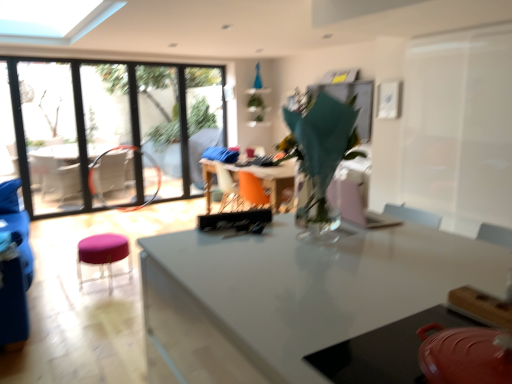
I want to click on translucent glass vase at center, so click(319, 158).

Describe the element at coordinates (271, 179) in the screenshot. I see `transparent glass vase at center, the first table from the top` at that location.

This screenshot has width=512, height=384. What do you see at coordinates (103, 255) in the screenshot?
I see `purple fabric stool at lower left` at bounding box center [103, 255].

The width and height of the screenshot is (512, 384). Describe the element at coordinates (257, 107) in the screenshot. I see `green leafy plant at upper center` at that location.

What do you see at coordinates (109, 130) in the screenshot? This screenshot has width=512, height=384. I see `transparent glass window at left` at bounding box center [109, 130].

What is the approximate width of transparent plastic screen door at right?

It is 4.58 inches.

The width and height of the screenshot is (512, 384). In order to click on translucent glass vase at center in this screenshot , I will do `click(319, 158)`.

Could you tell me if green leafy plant at upper center is facing purple fabric stool at lower left?

No, green leafy plant at upper center is not facing towards purple fabric stool at lower left.

Is green leafy plant at upper center not near purple fabric stool at lower left?

That's right, there is a large distance between green leafy plant at upper center and purple fabric stool at lower left.

Which of these two, green leafy plant at upper center or purple fabric stool at lower left, is smaller?

green leafy plant at upper center.

What's the angular difference between green leafy plant at upper center and purple fabric stool at lower left's facing directions?

green leafy plant at upper center and purple fabric stool at lower left are facing 82.8 degrees away from each other.

In terms of height, does matte red pot at lower right, which ranks as the 1th table in front-to-back order, look taller or shorter compared to transparent plastic screen door at right?

Clearly, matte red pot at lower right, which ranks as the 1th table in front-to-back order, is shorter compared to transparent plastic screen door at right.

Is matte red pot at lower right, which ranks as the first table in bottom-to-top order, next to transparent plastic screen door at right?

matte red pot at lower right, which ranks as the first table in bottom-to-top order, and transparent plastic screen door at right are not in contact.

Based on the photo, measure the distance from matte red pot at lower right, acting as the 2th table starting from the back, to transparent plastic screen door at right.

matte red pot at lower right, acting as the 2th table starting from the back, and transparent plastic screen door at right are 2.25 meters apart.

Is point (381, 361) closer to camera compared to point (467, 93)?

Yes.

Is transparent glass window at left not within matte red pot at lower right, which ranks as the 1th table in front-to-back order?

transparent glass window at left is positioned outside matte red pot at lower right, which ranks as the 1th table in front-to-back order.

Is transparent glass window at left to the left of matte red pot at lower right, which ranks as the first table in bottom-to-top order, from the viewer's perspective?

Correct, you'll find transparent glass window at left to the left of matte red pot at lower right, which ranks as the first table in bottom-to-top order.

From a real-world perspective, between transparent glass window at left and matte red pot at lower right, acting as the 2th table starting from the back, who is vertically lower?

matte red pot at lower right, acting as the 2th table starting from the back, is physically lower.

Where is `window above the matte red pot at lower right, the 2th table when ordered from top to bottom (from the image's perspective)`? The image size is (512, 384). window above the matte red pot at lower right, the 2th table when ordered from top to bottom (from the image's perspective) is located at coordinates (109, 130).

What's the angular difference between transparent plastic screen door at right and translucent glass vase at center's facing directions?

The facing directions of transparent plastic screen door at right and translucent glass vase at center are 89.9 degrees apart.

Looking at this image, would you say transparent plastic screen door at right is outside translucent glass vase at center?

Absolutely, transparent plastic screen door at right is external to translucent glass vase at center.

Is transparent plastic screen door at right beside translucent glass vase at center?

No, transparent plastic screen door at right is not next to translucent glass vase at center.

Based on their positions, is transparent plastic screen door at right located to the left or right of translucent glass vase at center?

transparent plastic screen door at right is to the right of translucent glass vase at center.

Is there a large distance between matte red pot at lower right, the 2th table when ordered from top to bottom, and transparent glass vase at center, the first table from the top?

Yes, matte red pot at lower right, the 2th table when ordered from top to bottom, and transparent glass vase at center, the first table from the top, are quite far apart.

From a real-world perspective, which object stands above the other?

From a 3D spatial view, matte red pot at lower right, acting as the 2th table starting from the back, is above.

Considering the relative positions of matte red pot at lower right, the 2th table when ordered from top to bottom, and transparent glass vase at center, arranged as the second table when ordered from the bottom, in the image provided, is matte red pot at lower right, the 2th table when ordered from top to bottom, behind transparent glass vase at center, arranged as the second table when ordered from the bottom,?

No, it is in front of transparent glass vase at center, arranged as the second table when ordered from the bottom.

From the image's perspective, who appears lower, matte red pot at lower right, which ranks as the 1th table in front-to-back order, or transparent glass vase at center, which is the first table from back to front?

matte red pot at lower right, which ranks as the 1th table in front-to-back order, is shown below in the image.

Which is behind, purple fabric stool at lower left or green leafy plant at upper center?

green leafy plant at upper center is more distant.

At what (x,y) coordinates should I click in order to perform the action: click on bar stool on the left of green leafy plant at upper center. Please return your answer as a coordinate pair (x, y). Looking at the image, I should click on (103, 255).

How many degrees apart are the facing directions of purple fabric stool at lower left and green leafy plant at upper center?

82.8 degrees separate the facing orientations of purple fabric stool at lower left and green leafy plant at upper center.

Does purple fabric stool at lower left have a larger size compared to green leafy plant at upper center?

Yes.

Does point (298, 147) come farther from viewer compared to point (204, 178)?

That is False.

At what (x,y) coordinates should I click in order to perform the action: click on table that is the 2nd object directly below the translucent glass vase at center (from a real-world perspective). Please return your answer as a coordinate pair (x, y). Looking at the image, I should click on (271, 179).

Based on their positions, is translucent glass vase at center located to the left or right of transparent glass vase at center, arranged as the second table when ordered from the bottom?

In the image, translucent glass vase at center appears on the right side of transparent glass vase at center, arranged as the second table when ordered from the bottom.

Can transparent glass vase at center, which ranks as the 2th table in front-to-back order, be found inside translucent glass vase at center?

No, transparent glass vase at center, which ranks as the 2th table in front-to-back order, is not surrounded by translucent glass vase at center.

Identify the location of plant above the purple fabric stool at lower left (from the image's perspective). (257, 107).

At what (x,y) coordinates should I click in order to perform the action: click on screen door positioned vertically above the matte red pot at lower right, the 2th table when ordered from top to bottom (from a real-world perspective). Please return your answer as a coordinate pair (x, y). The height and width of the screenshot is (384, 512). Looking at the image, I should click on (459, 127).

Estimate the real-world distances between objects in this image. Which object is further from translucent glass vase at center, green leafy plant at upper center or transparent glass vase at center, arranged as the second table when ordered from the bottom?

Based on the image, green leafy plant at upper center appears to be further to translucent glass vase at center.

Looking at this image, which object lies further to the anchor point transparent glass vase at center, arranged as the second table when ordered from the bottom, purple fabric stool at lower left or transparent glass window at left?

transparent glass window at left is further to transparent glass vase at center, arranged as the second table when ordered from the bottom.

Based on their spatial positions, is transparent plastic screen door at right or matte red pot at lower right, acting as the 2th table starting from the back, closer to transparent glass vase at center, arranged as the second table when ordered from the bottom?

transparent plastic screen door at right is positioned closer to the anchor transparent glass vase at center, arranged as the second table when ordered from the bottom.

Looking at the image, which one is located closer to translucent glass vase at center, matte red pot at lower right, acting as the 2th table starting from the back, or green leafy plant at upper center?

matte red pot at lower right, acting as the 2th table starting from the back, lies closer to translucent glass vase at center than the other object.

Looking at the image, which one is located closer to transparent glass vase at center, which ranks as the 2th table in front-to-back order, matte red pot at lower right, which ranks as the first table in bottom-to-top order, or transparent plastic screen door at right?

The object closer to transparent glass vase at center, which ranks as the 2th table in front-to-back order, is transparent plastic screen door at right.

Estimate the real-world distances between objects in this image. Which object is further from purple fabric stool at lower left, transparent glass vase at center, which ranks as the 2th table in front-to-back order, or transparent plastic screen door at right?

transparent plastic screen door at right is further to purple fabric stool at lower left.

Based on the photo, from the image, which object appears to be farther from transparent plastic screen door at right, transparent glass window at left or purple fabric stool at lower left?

transparent glass window at left.

Considering their positions, is transparent glass vase at center, the first table from the top, positioned closer to green leafy plant at upper center than translucent glass vase at center?

Among the two, transparent glass vase at center, the first table from the top, is located nearer to green leafy plant at upper center.

This screenshot has height=384, width=512. Identify the location of houseplant between matte red pot at lower right, which ranks as the 1th table in front-to-back order, and transparent plastic screen door at right in the front-back direction. (319, 158).

Find the location of `window positioned between purple fabric stool at lower left and green leafy plant at upper center from near to far`. window positioned between purple fabric stool at lower left and green leafy plant at upper center from near to far is located at coordinates (109, 130).

Where is `window located between transparent glass vase at center, which ranks as the 2th table in front-to-back order, and green leafy plant at upper center in the depth direction`? The height and width of the screenshot is (384, 512). window located between transparent glass vase at center, which ranks as the 2th table in front-to-back order, and green leafy plant at upper center in the depth direction is located at coordinates (109, 130).

Identify the location of table between translucent glass vase at center and transparent glass window at left along the z-axis. (271, 179).